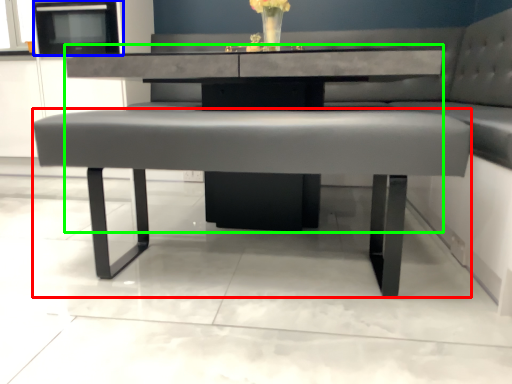
Question: Which is nearer to the coffee table (highlighted by a red box)? appliance (highlighted by a blue box) or round table (highlighted by a green box).

Choices:
 (A) appliance
 (B) round table

Answer: (B)